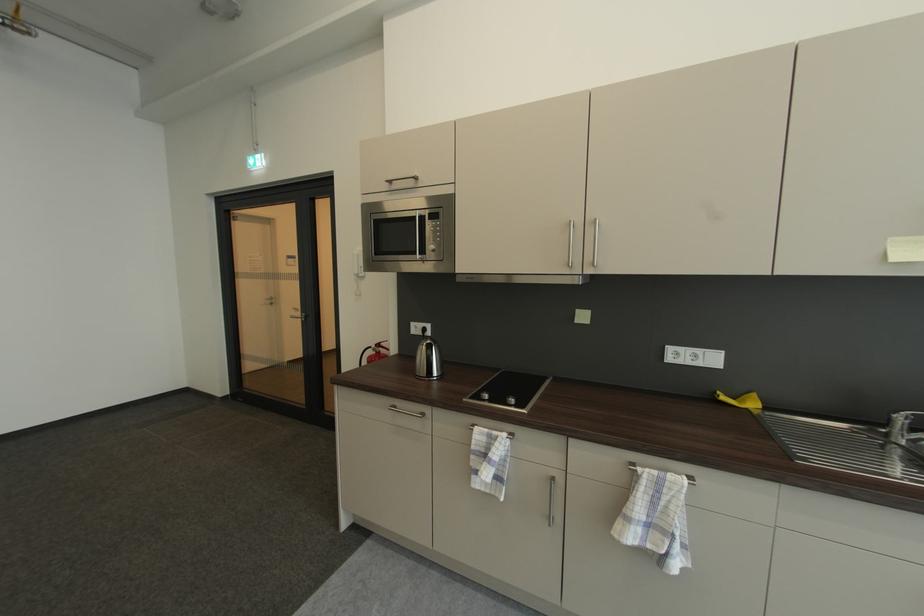
Find the location of a particular element. The width and height of the screenshot is (924, 616). microwave button is located at coordinates (432, 246).